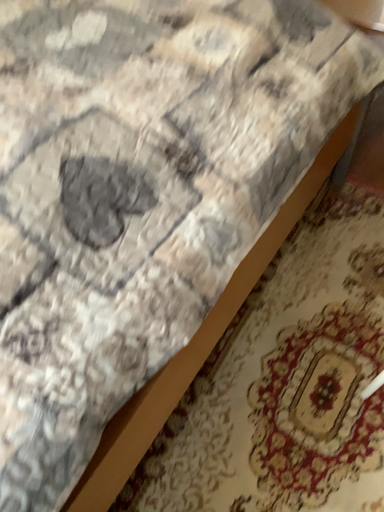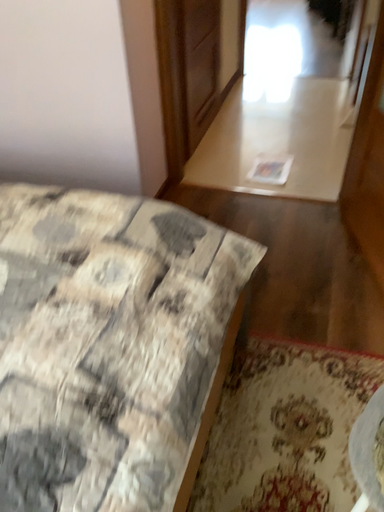
Question: Which way did the camera rotate in the video?

Choices:
 (A) rotated right
 (B) rotated left

Answer: (A)